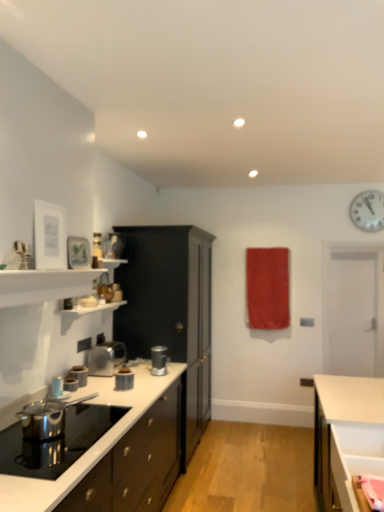
Question: Would you say white metallic clock at upper right contains satin silver blender at center, placed as the fifth kitchen appliance when sorted from front to back?

Choices:
 (A) yes
 (B) no

Answer: (B)

Question: Does white metallic clock at upper right touch satin silver blender at center, placed as the fifth kitchen appliance when sorted from front to back?

Choices:
 (A) yes
 (B) no

Answer: (B)

Question: Is white metallic clock at upper right not close to satin silver blender at center, which is counted as the 1th kitchen appliance, starting from the back?

Choices:
 (A) yes
 (B) no

Answer: (A)

Question: Can you confirm if white metallic clock at upper right is taller than satin silver blender at center, placed as the fifth kitchen appliance when sorted from front to back?

Choices:
 (A) no
 (B) yes

Answer: (B)

Question: Does white metallic clock at upper right turn towards satin silver blender at center, placed as the fifth kitchen appliance when sorted from front to back?

Choices:
 (A) no
 (B) yes

Answer: (A)

Question: Does white metallic clock at upper right have a lesser width compared to satin silver blender at center, acting as the first kitchen appliance starting from the right?

Choices:
 (A) yes
 (B) no

Answer: (A)

Question: Does polished stainless steel kettle at lower left, which ranks as the first appliance in front-to-back order, have a larger size compared to metallic silver toaster at left, which is counted as the 3th kitchen appliance, starting from the right?

Choices:
 (A) yes
 (B) no

Answer: (A)

Question: Can you confirm if polished stainless steel kettle at lower left, which appears as the 2th appliance when viewed from the back, is smaller than metallic silver toaster at left, which is counted as the 3th kitchen appliance, starting from the right?

Choices:
 (A) yes
 (B) no

Answer: (B)

Question: Is polished stainless steel kettle at lower left, which appears as the 2th appliance when viewed from the back, taller than metallic silver toaster at left, the fourth kitchen appliance positioned from the front?

Choices:
 (A) yes
 (B) no

Answer: (A)

Question: Is polished stainless steel kettle at lower left, which appears as the 2th appliance when viewed from the back, at the right side of metallic silver toaster at left, which is counted as the second kitchen appliance, starting from the back?

Choices:
 (A) yes
 (B) no

Answer: (A)

Question: Can you confirm if polished stainless steel kettle at lower left, which appears as the 2th appliance when viewed from the back, is thinner than metallic silver toaster at left, the fourth kitchen appliance positioned from the front?

Choices:
 (A) yes
 (B) no

Answer: (B)

Question: From the image's perspective, would you say polished stainless steel kettle at lower left, which appears as the 2th appliance when viewed from the back, is shown under metallic silver toaster at left, which is the 3th kitchen appliance in left-to-right order?

Choices:
 (A) no
 (B) yes

Answer: (A)

Question: Does satin silver blender at center, placed as the fifth kitchen appliance when sorted from front to back, come in front of metallic silver toaster at center, which ranks as the third kitchen appliance in back-to-front order?

Choices:
 (A) no
 (B) yes

Answer: (A)